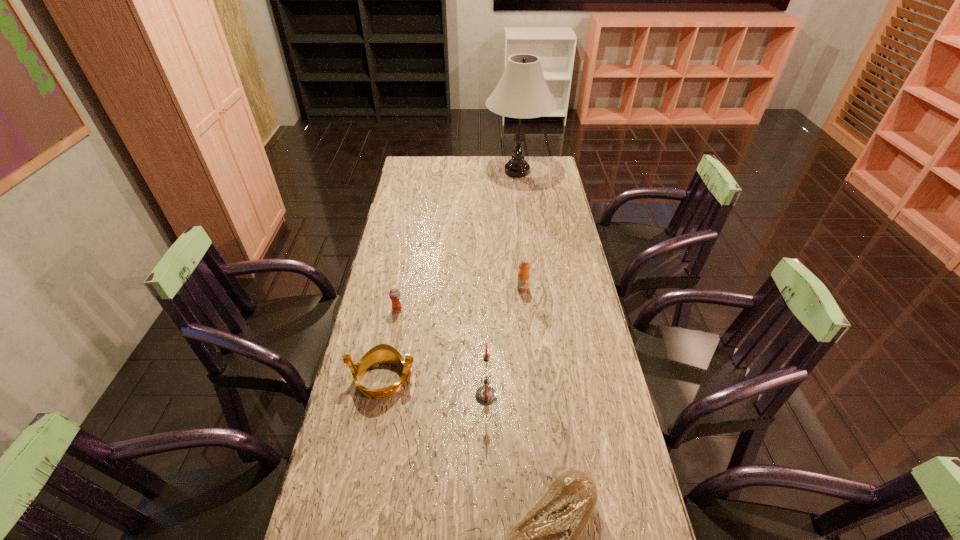
Where is `lamp`? The image size is (960, 540). lamp is located at coordinates [522, 92].

Locate an element on the screen. Image resolution: width=960 pixels, height=540 pixels. the farthest object is located at coordinates (522, 92).

This screenshot has height=540, width=960. In order to click on the second tallest object in this screenshot , I will do `click(485, 395)`.

The height and width of the screenshot is (540, 960). I want to click on the third tallest object, so click(524, 266).

The image size is (960, 540). Find the location of `the farther orange juice`. the farther orange juice is located at coordinates (524, 266).

This screenshot has height=540, width=960. In order to click on tiara in this screenshot , I will do `click(383, 353)`.

The height and width of the screenshot is (540, 960). I want to click on the shorter orange juice, so click(x=394, y=294).

Where is `the nearer orange juice`? This screenshot has width=960, height=540. the nearer orange juice is located at coordinates (394, 294).

The image size is (960, 540). Find the location of `free spot located 0.390m on the front of the farthest object`. free spot located 0.390m on the front of the farthest object is located at coordinates (525, 240).

Image resolution: width=960 pixels, height=540 pixels. In order to click on free space located on the front-facing side of the candle in this screenshot , I will do `click(397, 396)`.